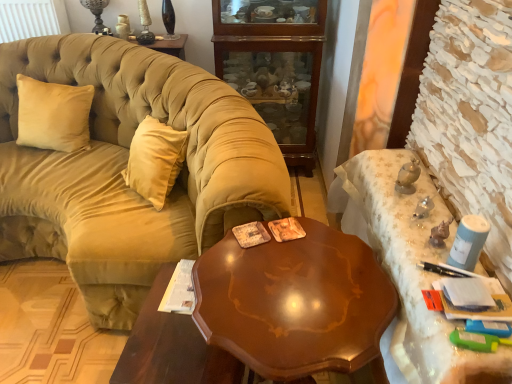
Image resolution: width=512 pixels, height=384 pixels. In order to click on empty space that is ontop of glossy wood table at center (from a real-world perspective) in this screenshot , I will do `click(178, 329)`.